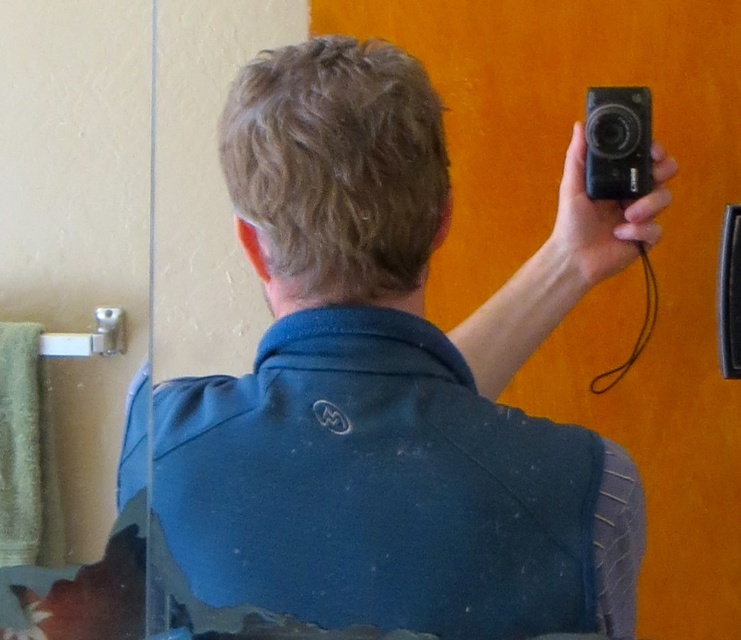
Does point (350, 168) lie behind point (637, 109)?

No, it is not.

Who is more distant from viewer, (x=428, y=380) or (x=622, y=193)?

The point (x=622, y=193) is more distant.

Between point (275, 198) and point (597, 173), which one is positioned in front?

Point (275, 198) is more forward.

Locate an element on the screen. This screenshot has width=741, height=640. blue fabric shirt at upper center is located at coordinates (392, 381).